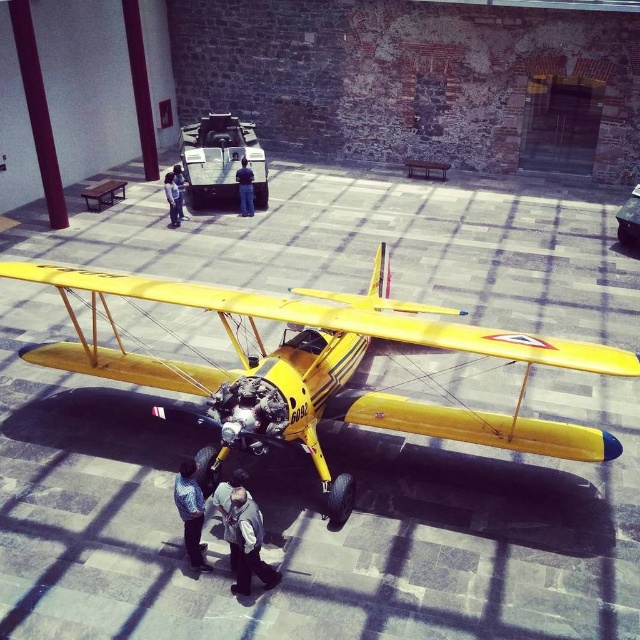
Question: Which object is farther from the camera taking this photo?

Choices:
 (A) yellow matte biplane at center
 (B) yellow matte airplane at center
 (C) light gray fabric jacket at center

Answer: (A)

Question: Which point is closer to the camera?

Choices:
 (A) 170,179
 (B) 243,577
 (C) 180,170
 (D) 224,116

Answer: (B)

Question: In this image, where is yellow matte airplane at center located relative to light blue jeans at center?

Choices:
 (A) left
 (B) right

Answer: (B)

Question: Which point is farther to the camera?

Choices:
 (A) yellow matte biplane at center
 (B) gray fabric jacket at lower center
 (C) yellow matte airplane at center

Answer: (A)

Question: Does yellow matte airplane at center appear on the right side of light blue jeans at center?

Choices:
 (A) no
 (B) yes

Answer: (B)

Question: Is patterned fabric shirt at lower center positioned before light gray fabric jacket at center?

Choices:
 (A) no
 (B) yes

Answer: (A)